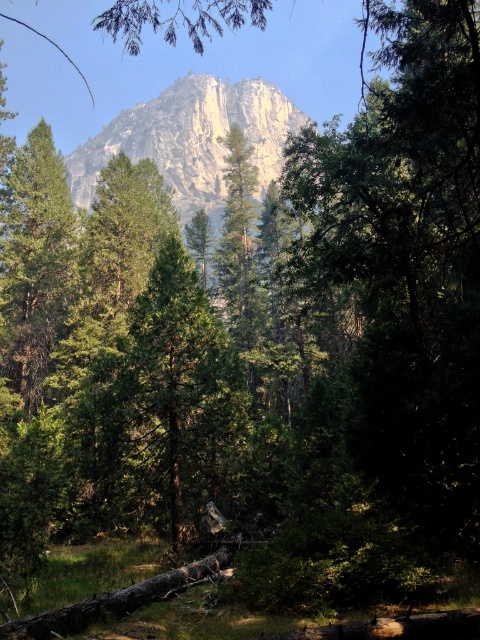
You are planning to set up a tent in this forest scene. The smooth rock mountain at upper center and the green matte tree at left are in your view. Which object would you consider for determining the best spot to avoid strong winds? Explain your reasoning based on their positions and characteristics.

The smooth rock mountain at upper center is wider than the green matte tree at left. Since mountains can block wind more effectively due to their larger size and solid structure, setting up the tent near the smooth rock mountain at upper center would provide better protection from strong winds compared to the narrower green matte tree at left.

You are a hiker standing at the base of the green matte tree at left. You want to reach the top of the smooth rock mountain at upper center. Which object will you have to climb over or around?

The smooth rock mountain at upper center is much taller than the green matte tree at left, so you will have to climb over or around the smooth rock mountain at upper center to reach its top.

You are a hiker planning to take a photo of the smooth rock mountain at upper center and the green matte tree at left. Which object should you focus on first if you want both to be in sharp focus?

You should focus on the smooth rock mountain at upper center first because it is larger and closer to the camera than the green matte tree at left, ensuring both will be in focus when using depth of field properly.